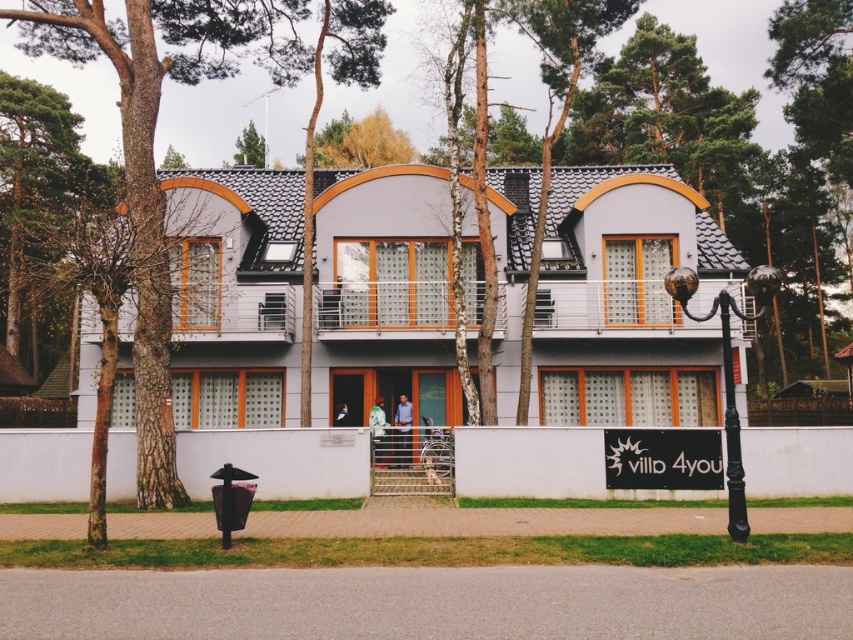
You are standing at the entrance of the building and notice two items at the center of the image. Which item is positioned higher up between the blue shirt at center and the green fabric jacket at center?

The blue shirt at center is positioned higher up than the green fabric jacket at center.